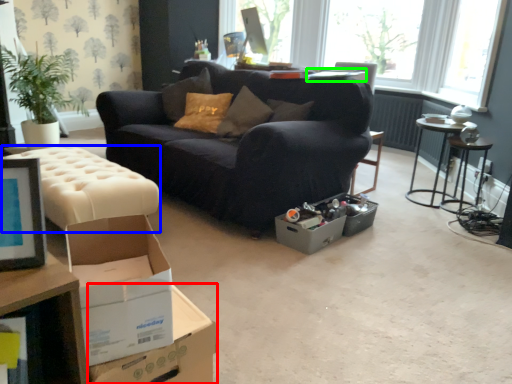
Question: Considering the real-world distances, which object is closest to cardboard box (highlighted by a red box)? swivel chair (highlighted by a blue box) or table (highlighted by a green box).

Choices:
 (A) swivel chair
 (B) table

Answer: (A)